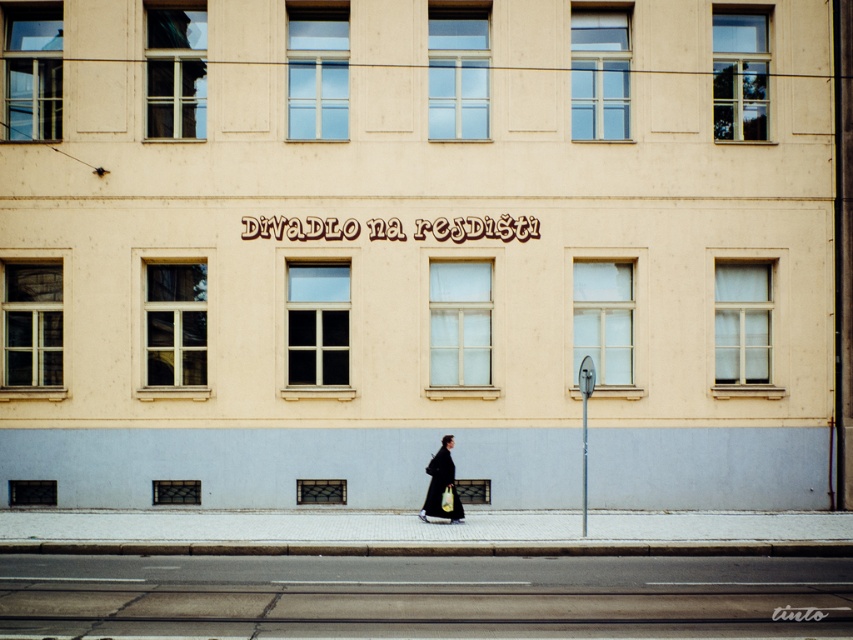
You are standing on the sidewalk in front of the building and notice the gray asphalt at lower center and the dark matte coat at center. Which object takes up more visual space in the image?

The dark matte coat at center occupies more visual space than the gray asphalt at lower center according to the description.

You are standing on the sidewalk in front of the building and want to place a small potted plant between the gray asphalt at lower center and the dark matte coat at center. Which object should the plant be closer to based on their widths?

The gray asphalt at lower center is thinner than the dark matte coat at center, so the plant should be placed closer to the gray asphalt at lower center to maintain balance between their widths.